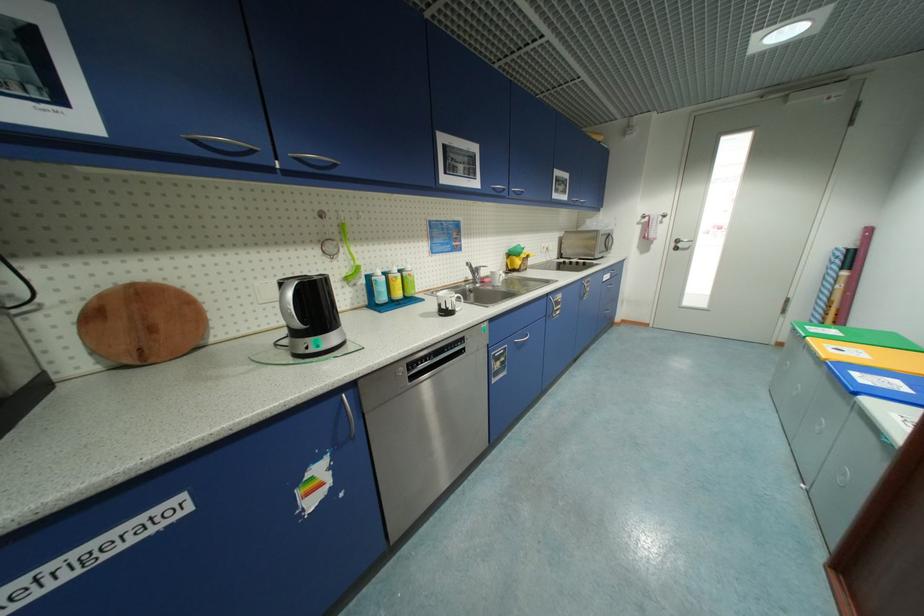
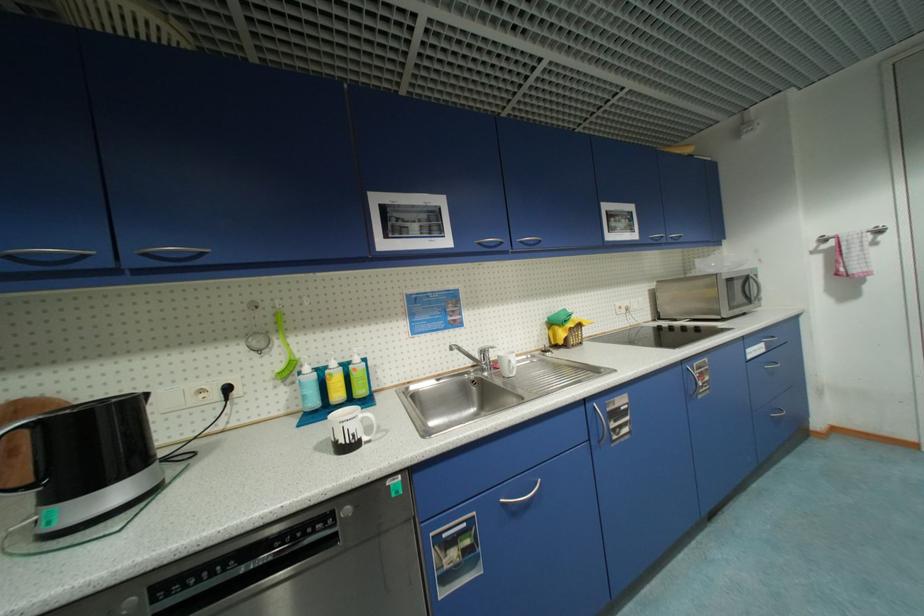
Question: How did the camera likely rotate?

Choices:
 (A) Left
 (B) Right
 (C) Up
 (D) Down

Answer: (A)